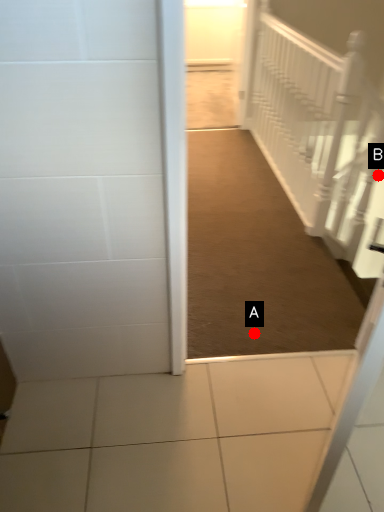
Question: Two points are circled on the image, labeled by A and B beside each circle. Which point is further to the camera?

Choices:
 (A) A is further
 (B) B is further

Answer: (B)